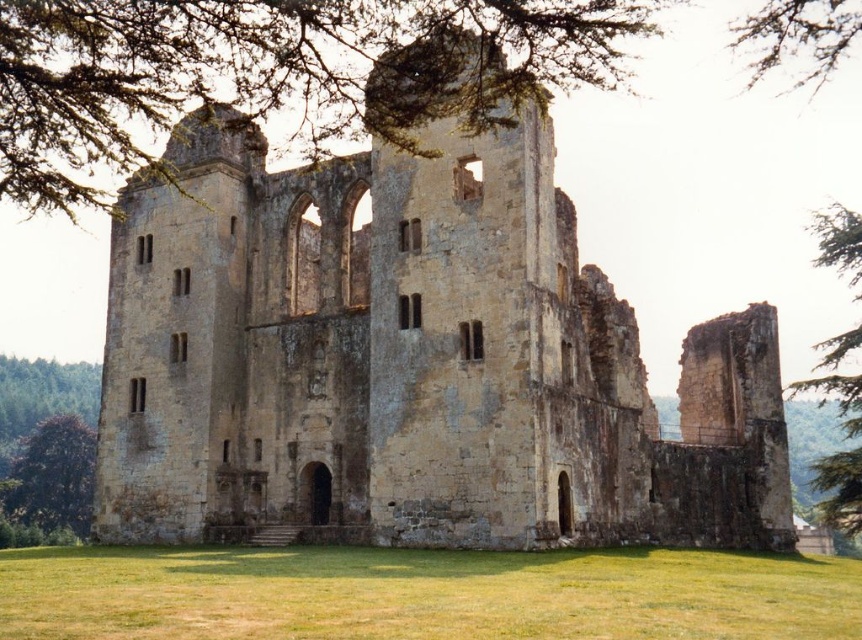
Is point (201, 275) more distant than point (823, 340)?

No, it is not.

Does yellow stone ruins at center appear on the left side of green leafy tree at upper right?

Correct, you'll find yellow stone ruins at center to the left of green leafy tree at upper right.

Is point (292, 513) positioned behind point (836, 259)?

No.

The width and height of the screenshot is (862, 640). I want to click on yellow stone ruins at center, so click(x=409, y=362).

Is point (860, 244) less distant than point (792, 38)?

Yes, point (860, 244) is closer to viewer.

Does green leafy tree at upper right appear on the left side of brown textured branch at upper center?

No, green leafy tree at upper right is not to the left of brown textured branch at upper center.

Is point (859, 522) positioned after point (826, 72)?

No, it is not.

This screenshot has width=862, height=640. What are the coordinates of `green leafy tree at upper right` in the screenshot? It's located at (841, 428).

How much distance is there between green leafy tree at upper left and green leafy tree at lower left?

green leafy tree at upper left and green leafy tree at lower left are 140.66 feet apart.

Does point (192, 72) come farther from viewer compared to point (19, 513)?

No.

I want to click on green leafy tree at upper left, so click(278, 74).